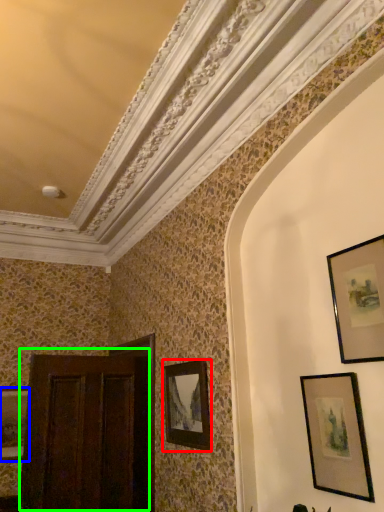
Question: Considering the real-world distances, which object is closest to picture frame (highlighted by a red box)? picture frame (highlighted by a blue box) or door (highlighted by a green box).

Choices:
 (A) picture frame
 (B) door

Answer: (B)